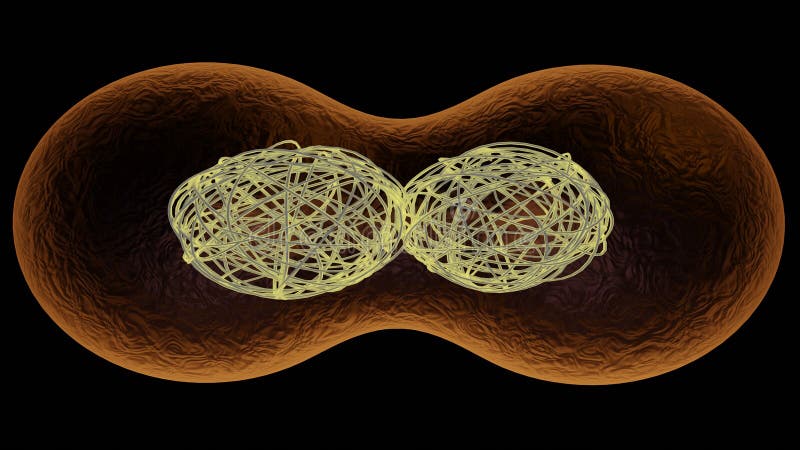
At what (x,y) coordinates should I click in order to perform the action: click on picture. Please return your answer as a coordinate pair (x, y). The width and height of the screenshot is (800, 450). Looking at the image, I should click on (600, 126).